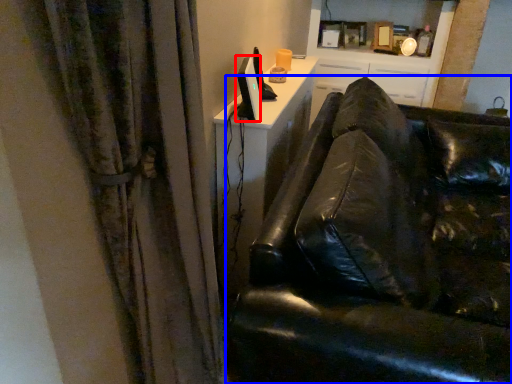
Question: Which of the following is the closest to the observer, computer monitor (highlighted by a red box) or studio couch (highlighted by a blue box)?

Choices:
 (A) computer monitor
 (B) studio couch

Answer: (B)